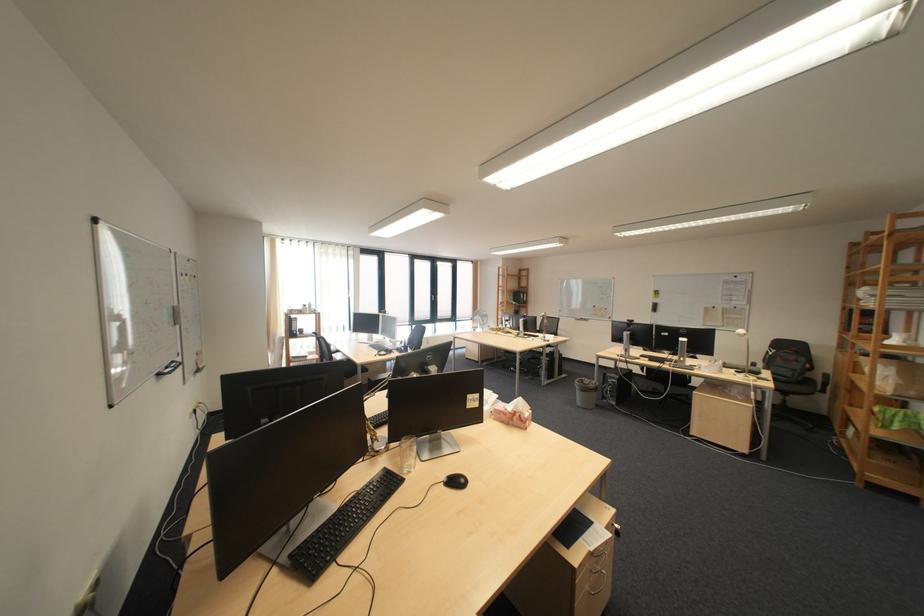
Find where to sit the chair sitting surface. Please return your answer as a coordinate pair (x, y).

(796, 387)